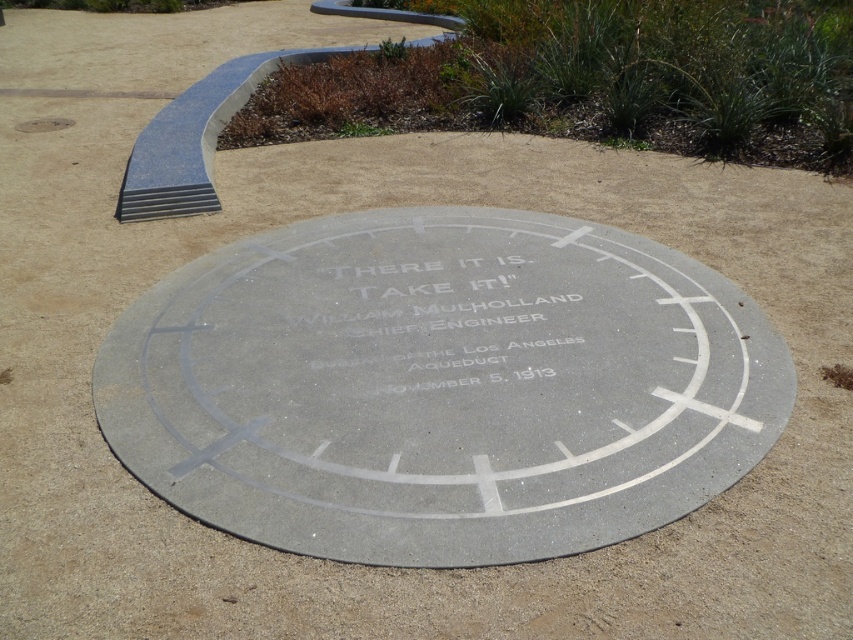
Is gray concrete circle at center closer to camera compared to white concrete engraving at center?

Yes.

Can you confirm if gray concrete circle at center is smaller than white concrete engraving at center?

Incorrect, gray concrete circle at center is not smaller in size than white concrete engraving at center.

Which is in front, point (525, 458) or point (517, 284)?

Point (525, 458) is more forward.

The image size is (853, 640). Find the location of `gray concrete circle at center`. gray concrete circle at center is located at coordinates (440, 387).

Between point (437, 282) and point (36, 129), which one is positioned in front?

Point (437, 282)

Can you confirm if white concrete engraving at center is positioned below gray concrete manhole cover at upper left?

Yes.

Who is more distant from viewer, (433,276) or (33,128)?

Point (33,128)

I want to click on white concrete engraving at center, so click(422, 317).

Between gray concrete circle at center and gray concrete manhole cover at upper left, which one appears on the left side from the viewer's perspective?

gray concrete manhole cover at upper left

Does gray concrete circle at center come in front of gray concrete manhole cover at upper left?

Yes, gray concrete circle at center is closer to the viewer.

Describe the element at coordinates (440, 387) in the screenshot. I see `gray concrete circle at center` at that location.

Image resolution: width=853 pixels, height=640 pixels. In order to click on gray concrete circle at center in this screenshot , I will do `click(440, 387)`.